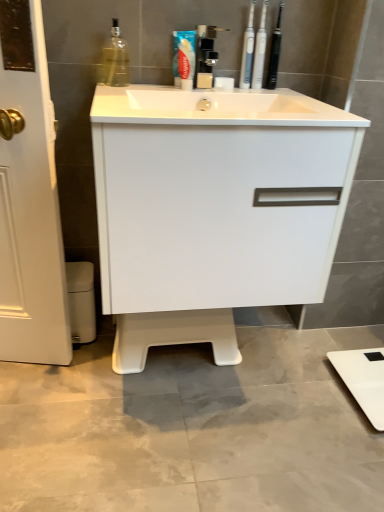
Locate an element on the screen. This screenshot has width=384, height=512. vacant area in front of white plastic toothbrushes at upper center, the 2th toiletry in the right-to-left sequence is located at coordinates (268, 95).